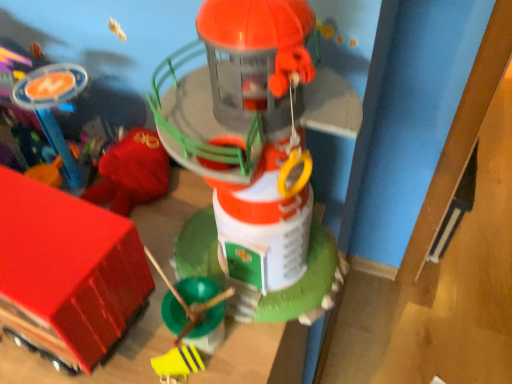
Question: In the image, is rubberized red truck at lower left, arranged as the third toy when viewed from the right, positioned in front of or behind yellow matte toy at lower center, the second toy positioned from the right?

Choices:
 (A) behind
 (B) front

Answer: (B)

Question: Would you say rubberized red truck at lower left, arranged as the third toy when viewed from the right, is to the left or to the right of yellow matte toy at lower center, the second toy positioned from the right, in the picture?

Choices:
 (A) left
 (B) right

Answer: (A)

Question: Which is farther from the yellow matte toy at lower center, marked as the second toy in a left-to-right arrangement?

Choices:
 (A) rubberized red truck at lower left, arranged as the third toy when viewed from the right
 (B) smooth plastic toy at center, which is the 1th toy from right to left

Answer: (B)

Question: Which object is positioned farthest from the yellow matte toy at lower center, the second toy positioned from the right?

Choices:
 (A) rubberized red truck at lower left, arranged as the first toy when viewed from the left
 (B) smooth plastic toy at center, which is the 1th toy from right to left

Answer: (B)